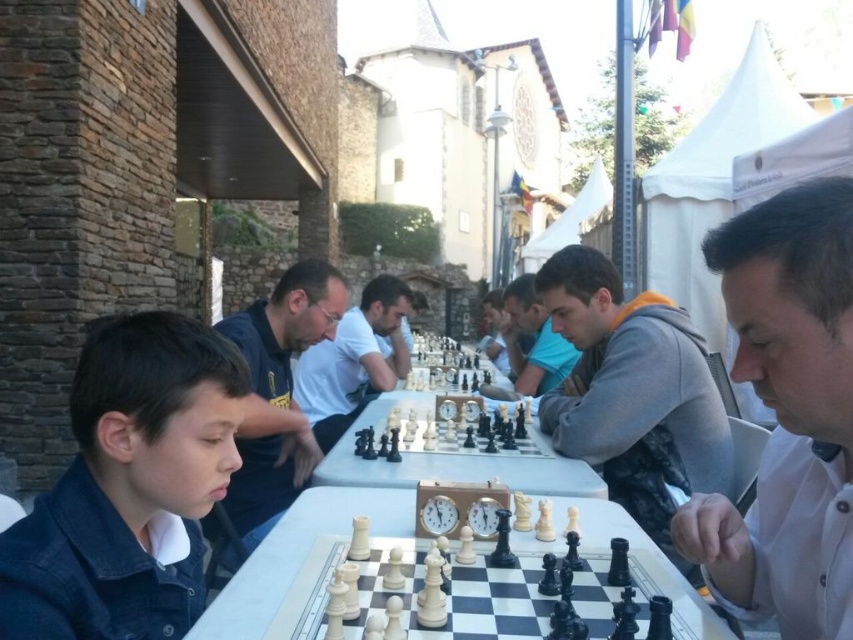
What is located at the coordinates point (277,388)?

The dark blue shirt at center is located at point (277,388).